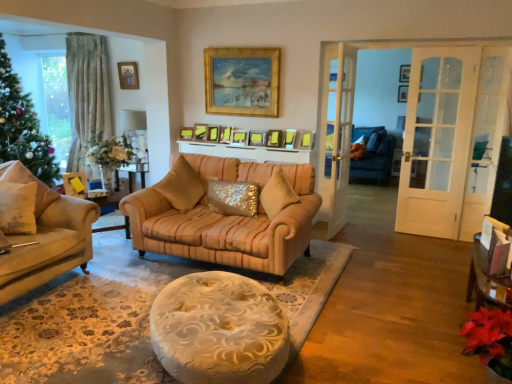
Image resolution: width=512 pixels, height=384 pixels. Find the location of `free spot above gold-framed painting at upper center, arranged as the 12th picture frame when viewed from the back (from a real-world perspective)`. free spot above gold-framed painting at upper center, arranged as the 12th picture frame when viewed from the back (from a real-world perspective) is located at coordinates (247, 50).